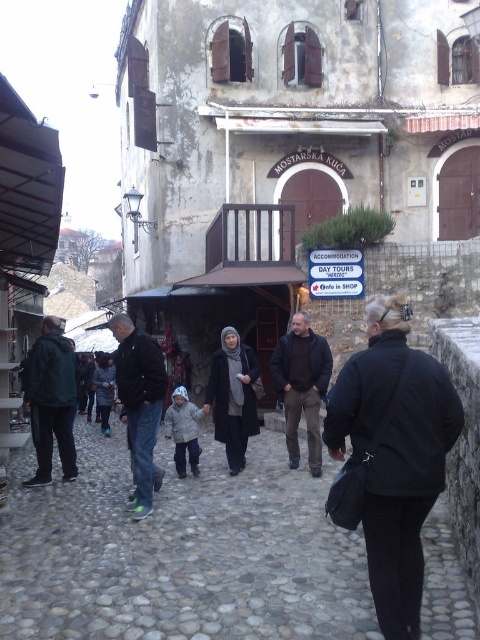
Question: Which object is positioned farthest from the cobblestone street at center?

Choices:
 (A) dark brown leather jacket at center
 (B) dark blue jeans at center

Answer: (A)

Question: Does black matte jacket at lower right have a larger size compared to blue plastic signboard at center?

Choices:
 (A) yes
 (B) no

Answer: (A)

Question: Can you confirm if cobblestone street at center is wider than black matte jacket at lower right?

Choices:
 (A) yes
 (B) no

Answer: (A)

Question: Among these points, which one is nearest to the camera?

Choices:
 (A) (304, 371)
 (B) (386, 358)
 (C) (187, 396)
 (D) (104, 410)

Answer: (B)

Question: Is cobblestone street at center wider than dark gray woolen coat at lower left?

Choices:
 (A) yes
 (B) no

Answer: (A)

Question: Which object is closer to the camera taking this photo?

Choices:
 (A) dark green jacket at left
 (B) light gray woolen coat at center

Answer: (A)